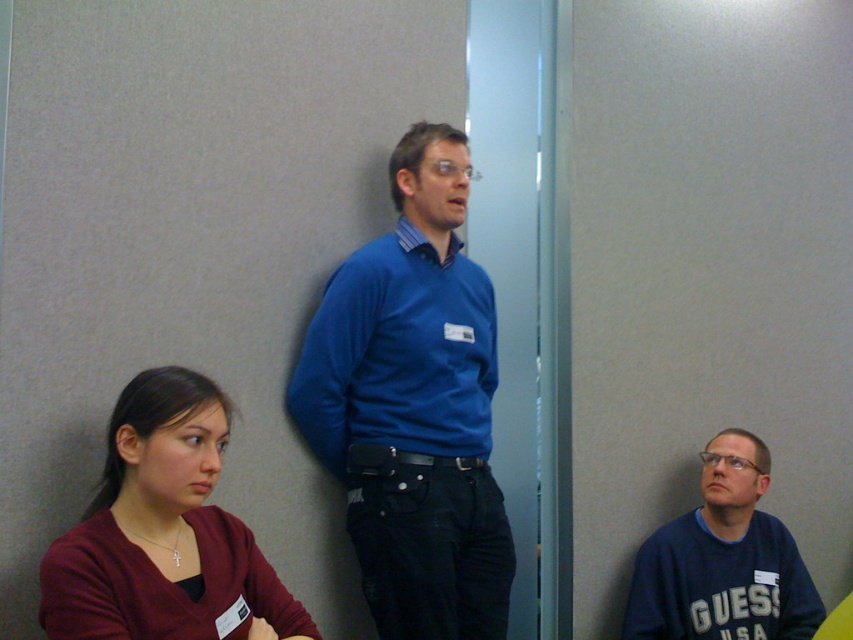
You are a photographer standing at the camera position. You want to take a closeup photo of the blue matte sweater at center. Is the sweater within your reach without moving the camera?

The blue matte sweater at center is 1.82 meters away from camera. Since the typical camera lens can focus on objects at that distance, the sweater is within reach for a closeup without moving the camera.

You are organizing a clothing donation drive and need to determine which item takes up more space when folded. Based on the image, which object is wider between the blue matte sweater at center and the blue smooth shirt at center?

The blue matte sweater at center is wider than the blue smooth shirt at center, so it takes up more space when folded.